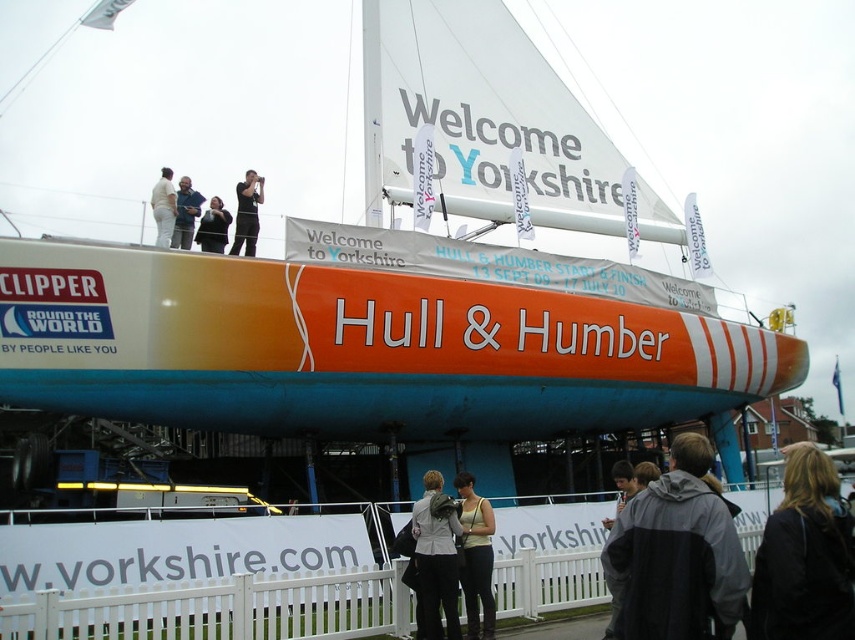
You are a photographer taking pictures of the event. You notice two jackets on the boat deck. The black fabric jacket at lower right and the dark gray jacket at upper center. Which jacket is positioned lower on the boat deck?

The black fabric jacket at lower right is positioned lower on the boat deck than the dark gray jacket at upper center.

You are standing on the deck of the Clipper Round the World yacht and see two jackets hanging on a rack. The black fabric jacket at lower right and the light gray fabric jacket at lower center. Which jacket is closer to you?

The black fabric jacket at lower right is closer to the viewer than the light gray fabric jacket at lower center.

You are a photographer standing on the dock, and you want to take a picture of the orange matte hull at center. Where should you position yourself to capture it in the frame?

You should position yourself at point [181,115] to capture the orange matte hull at center in the frame.